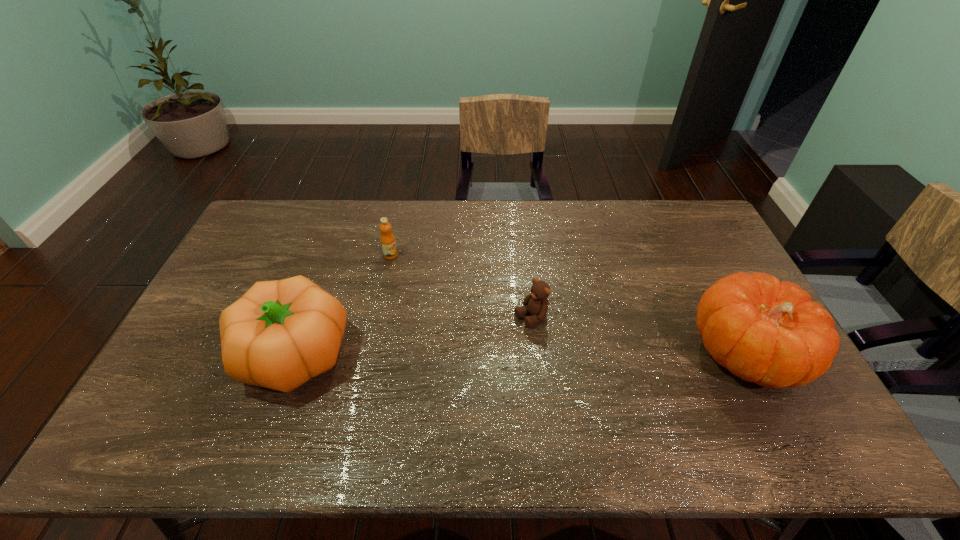
The height and width of the screenshot is (540, 960). In order to click on vacant region located 0.150m on the front label of the farthest object in this screenshot , I will do pos(430,276).

At what (x,y) coordinates should I click in order to perform the action: click on free location located 0.080m on the front label of the farthest object. Please return your answer as a coordinate pair (x, y). The width and height of the screenshot is (960, 540). Looking at the image, I should click on (414, 267).

This screenshot has width=960, height=540. What are the coordinates of `vacant space located on the front label of the farthest object` in the screenshot? It's located at (457, 290).

Where is `vacant area situated 0.310m on the face of the teddy bear`? Image resolution: width=960 pixels, height=540 pixels. vacant area situated 0.310m on the face of the teddy bear is located at coordinates (426, 378).

The width and height of the screenshot is (960, 540). I want to click on vacant space located 0.230m on the face of the teddy bear, so click(451, 363).

Locate an element on the screen. This screenshot has height=540, width=960. blank space located on the face of the teddy bear is located at coordinates (491, 341).

Locate an element on the screen. The width and height of the screenshot is (960, 540). object present at the right edge is located at coordinates (763, 331).

At what (x,y) coordinates should I click in order to perform the action: click on object present at the near right corner. Please return your answer as a coordinate pair (x, y). The height and width of the screenshot is (540, 960). Looking at the image, I should click on (763, 331).

In the image, there is a desktop. Where is `blank space at the far edge`? blank space at the far edge is located at coordinates (434, 206).

Image resolution: width=960 pixels, height=540 pixels. In order to click on free space at the near edge of the desktop in this screenshot , I will do `click(619, 413)`.